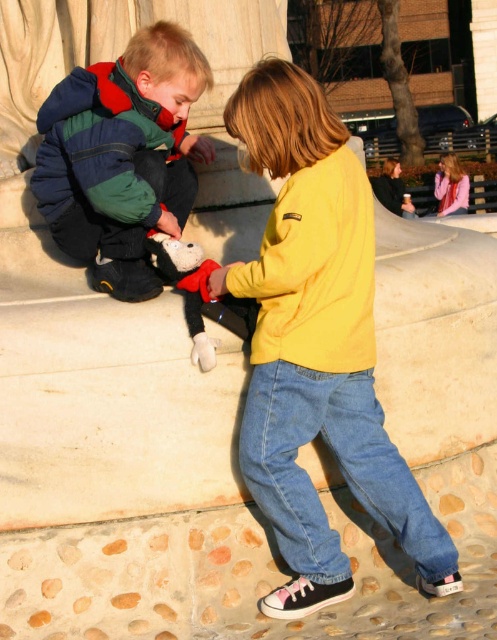
You are a photographer trying to capture the denim jeans at lower center in the image. Using a coordinate system where the bottom left corner is the origin, can you confirm if the jeans are located in the lower half of the image?

The denim jeans at lower center are positioned at coordinates point [338,468]. Since the y coordinate is 0.682, which is above the midpoint of 0.5, the jeans are actually in the upper half of the image.

You are a photographer trying to capture a photo of the two children and their toy. Based on the scene, which piece of clothing is positioned lower in the image between the denim jeans at lower center and the denim at left?

The denim jeans at lower center is positioned lower in the image than the denim at left.